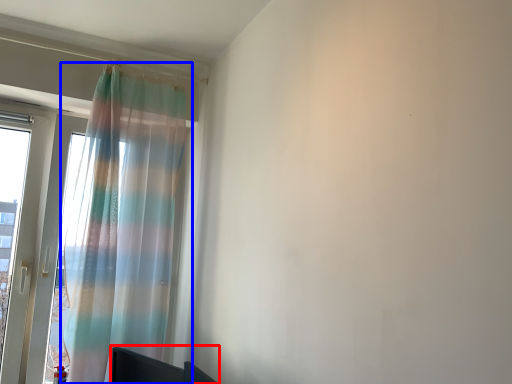
Question: Which object is further to the camera taking this photo, furniture (highlighted by a red box) or curtain (highlighted by a blue box)?

Choices:
 (A) furniture
 (B) curtain

Answer: (B)